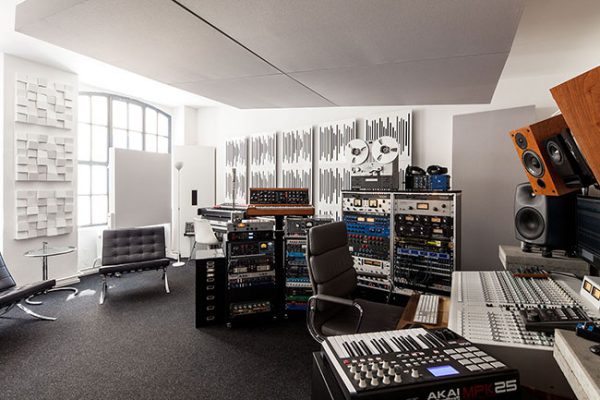
At what (x,y) coordinates should I click in order to perform the action: click on grey chairs. Please return your answer as a coordinate pair (x, y). The width and height of the screenshot is (600, 400). Looking at the image, I should click on (16, 293), (126, 263).